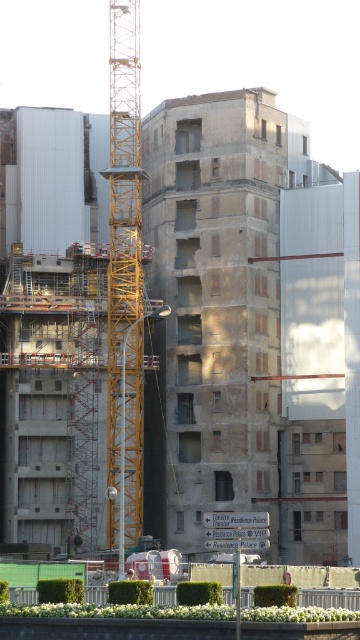
Looking at this image, you are a construction worker standing at the base of the crane and want to determine which of the two points, point (117,202) or point (190,620), is closer to you. Which point is closer?

Point (117,202) is further to the viewer than point (190,620), so the point closer to you is point (190,620).

You are a construction worker planning to place a new steel beam between the yellow metallic crane at center and the concrete wall at center. Given their widths, which object should you position closer to the narrower side to ensure stability?

The yellow metallic crane at center has a lesser width compared to the concrete wall at center, so you should position the steel beam closer to the yellow metallic crane at center to ensure stability.